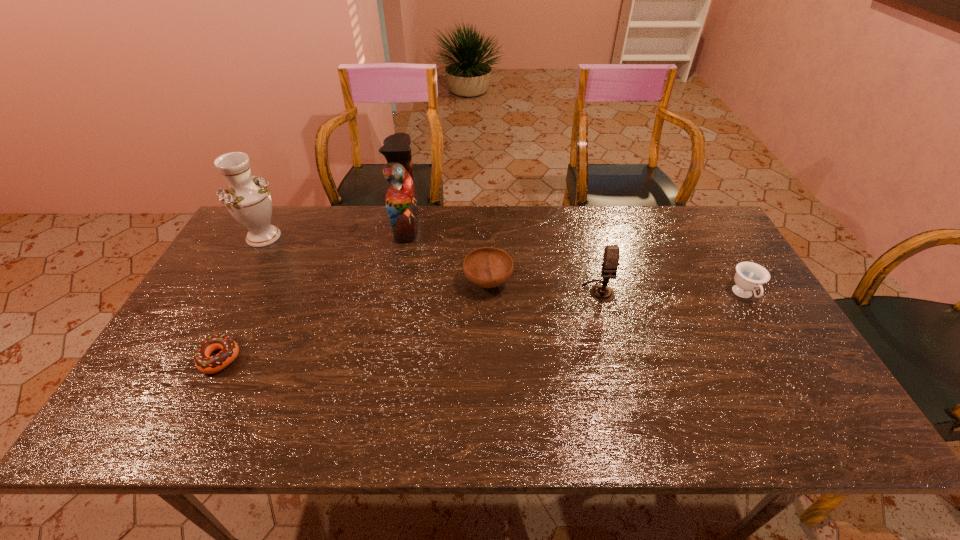
Locate an element on the screen. The height and width of the screenshot is (540, 960). vacant position at the far edge of the desktop is located at coordinates (451, 233).

Where is `free space at the near edge of the desktop`? This screenshot has width=960, height=540. free space at the near edge of the desktop is located at coordinates (526, 416).

The height and width of the screenshot is (540, 960). Identify the location of free space at the left edge of the desktop. (239, 296).

In the image, there is a desktop. Identify the location of vacant space at the right edge. Image resolution: width=960 pixels, height=540 pixels. (709, 292).

Locate an element on the screen. Image resolution: width=960 pixels, height=540 pixels. free space at the far left corner is located at coordinates (234, 250).

I want to click on free space at the far right corner, so click(x=692, y=217).

At what (x,y) coordinates should I click in order to perform the action: click on vacant region between the teacup and the fourth object from left to right. Please return your answer as a coordinate pair (x, y). The image size is (960, 540). Looking at the image, I should click on (616, 289).

Where is `vacant space in between the fifth object from left to right and the vase`? This screenshot has width=960, height=540. vacant space in between the fifth object from left to right and the vase is located at coordinates click(431, 264).

Locate an element on the screen. Image resolution: width=960 pixels, height=540 pixels. free space between the vase and the third object from right to left is located at coordinates (375, 260).

Where is `empty location between the bowl and the vase`? This screenshot has width=960, height=540. empty location between the bowl and the vase is located at coordinates (375, 260).